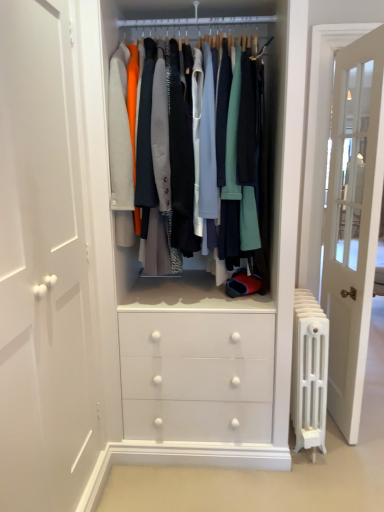
You are a GUI agent. You are given a task and a screenshot of the screen. Output one action in this format:
    pyautogui.click(x=<x>, y=<y>)
    Task: Click on the vacant space in front of white metal radiator at right
    The height and width of the screenshot is (512, 384).
    Given the screenshot: What is the action you would take?
    pyautogui.click(x=314, y=481)